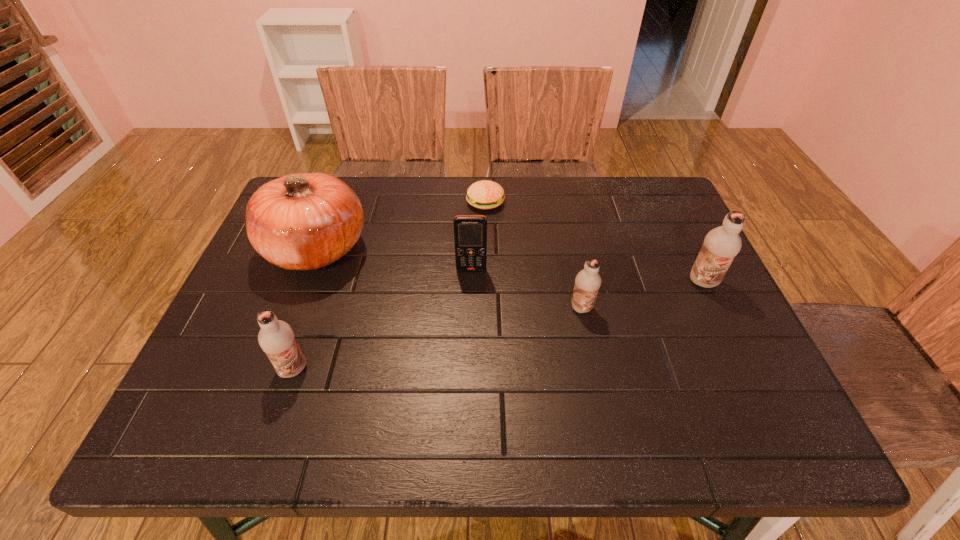
Image resolution: width=960 pixels, height=540 pixels. In order to click on pumpkin present at the left edge in this screenshot , I will do `click(306, 221)`.

Locate an element on the screen. This screenshot has height=540, width=960. object present at the right edge is located at coordinates (721, 244).

The width and height of the screenshot is (960, 540). Find the location of `object that is positioned at the far left corner`. object that is positioned at the far left corner is located at coordinates (306, 221).

Where is `object located at the near left corner`? The height and width of the screenshot is (540, 960). object located at the near left corner is located at coordinates (276, 338).

Locate an element on the screen. free space at the far edge of the desktop is located at coordinates (398, 220).

Where is `vacant space at the near edge of the desktop`? The width and height of the screenshot is (960, 540). vacant space at the near edge of the desktop is located at coordinates (556, 379).

In the image, there is a desktop. At what (x,y) coordinates should I click in order to perform the action: click on vacant space at the left edge. Please return your answer as a coordinate pair (x, y). Looking at the image, I should click on (229, 309).

In the image, there is a desktop. Where is `free space at the right edge`? This screenshot has height=540, width=960. free space at the right edge is located at coordinates (716, 310).

In the image, there is a desktop. Where is `vacant space at the near right corner`? This screenshot has height=540, width=960. vacant space at the near right corner is located at coordinates 708,385.

Find the location of a particular element. vacant point located between the second object from right to left and the rightmost chocolate milk is located at coordinates (642, 295).